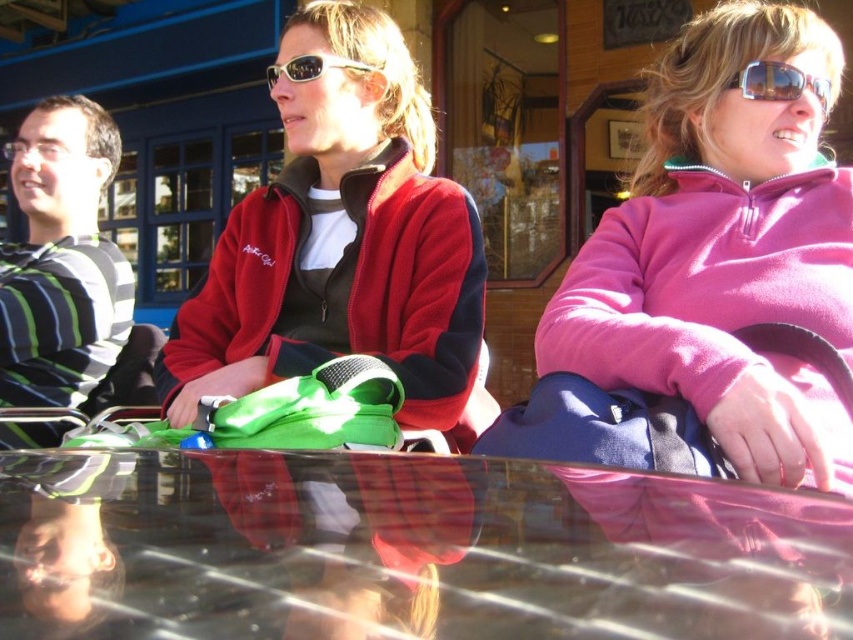
Question: Which object appears closest to the camera in this image?

Choices:
 (A) pink fleece jacket at upper right
 (B) transparent glass table at center

Answer: (B)

Question: Is sunglasses at upper right smaller than sunglasses at center?

Choices:
 (A) no
 (B) yes

Answer: (B)

Question: Among these points, which one is nearest to the camera?

Choices:
 (A) (798, 81)
 (B) (724, 20)
 (C) (329, 49)
 (D) (61, 592)

Answer: (D)

Question: Which point is farther from the camera taking this photo?

Choices:
 (A) (781, 92)
 (B) (305, 81)
 (C) (55, 308)
 (D) (776, 228)

Answer: (C)

Question: Can you confirm if transparent glass table at center is positioned above matte red fleece jacket at center?

Choices:
 (A) no
 (B) yes

Answer: (A)

Question: Is the position of striped cotton shirt at left more distant than that of sunglasses at center?

Choices:
 (A) yes
 (B) no

Answer: (A)